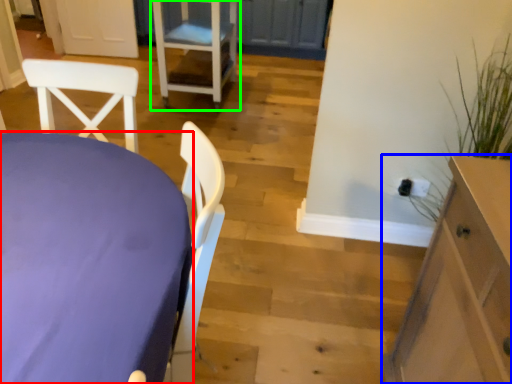
Question: Which object is positioned farthest from table (highlighted by a red box)? Select from cabinetry (highlighted by a blue box) and chair (highlighted by a green box).

Choices:
 (A) cabinetry
 (B) chair

Answer: (B)